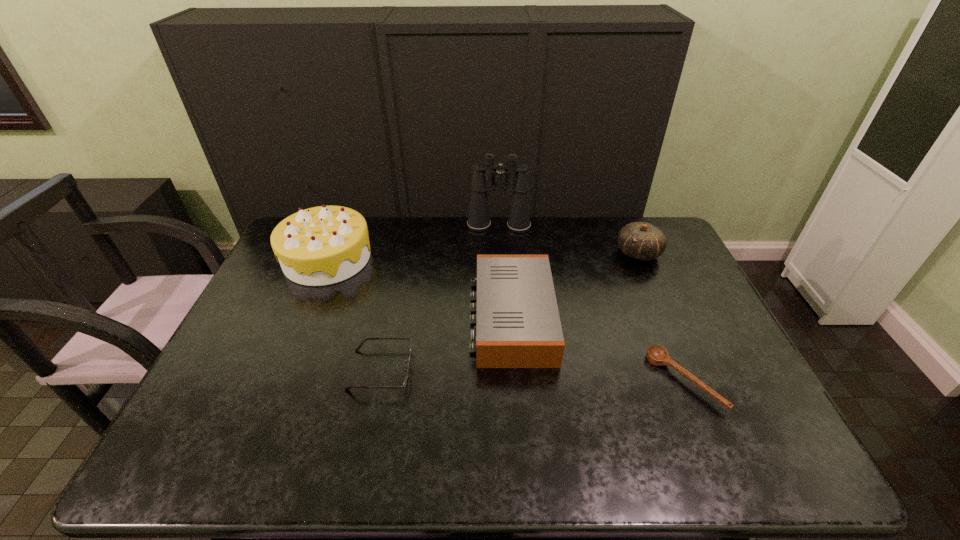
Locate an element on the screen. The image size is (960, 540). the tallest object is located at coordinates (483, 180).

Find the location of a particular element. the fifth shortest object is located at coordinates (323, 245).

The image size is (960, 540). What are the coordinates of `birthday cake` in the screenshot? It's located at (323, 245).

The height and width of the screenshot is (540, 960). I want to click on the fourth shortest object, so click(x=640, y=240).

At what (x,y) coordinates should I click in order to perform the action: click on the fourth tallest object. Please return your answer as a coordinate pair (x, y). This screenshot has width=960, height=540. Looking at the image, I should click on (518, 325).

Locate an element on the screen. The height and width of the screenshot is (540, 960). the second shortest object is located at coordinates (357, 349).

Identify the location of the fifth object from right to left. Image resolution: width=960 pixels, height=540 pixels. (357, 349).

The height and width of the screenshot is (540, 960). In order to click on the shortest object in this screenshot , I will do `click(656, 355)`.

Image resolution: width=960 pixels, height=540 pixels. In order to click on vacant space located 0.190m on the front of the tallest object in this screenshot , I will do `click(501, 266)`.

At what (x,y) coordinates should I click in order to perform the action: click on free space located on the front of the fifth shortest object. Please return your answer as a coordinate pair (x, y). Image resolution: width=960 pixels, height=540 pixels. Looking at the image, I should click on [278, 374].